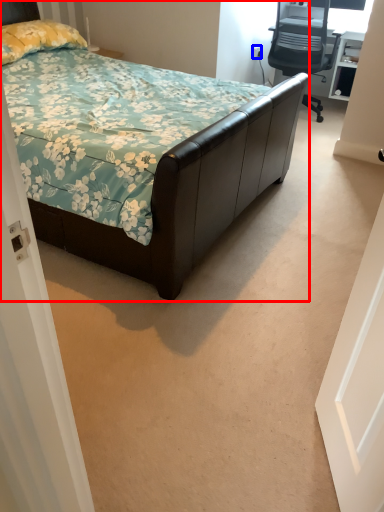
Question: Which object is further to the camera taking this photo, bed (highlighted by a red box) or power outlet (highlighted by a blue box)?

Choices:
 (A) bed
 (B) power outlet

Answer: (B)